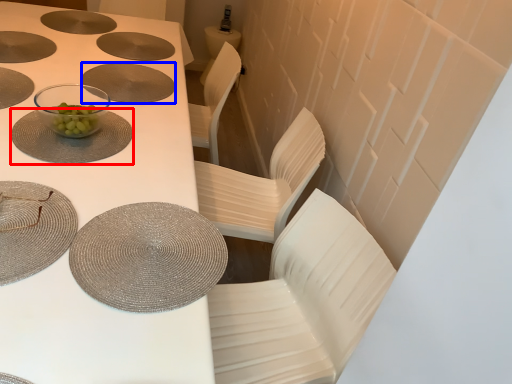
Question: Which point is further to the camera, tableware (highlighted by a red box) or plate (highlighted by a blue box)?

Choices:
 (A) tableware
 (B) plate

Answer: (B)